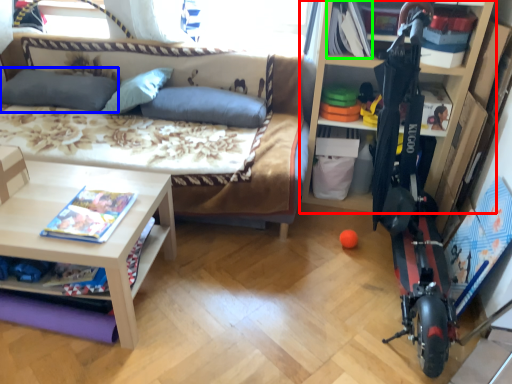
Question: Which object is positioned farthest from shelf (highlighted by a red box)? Select from pillow (highlighted by a blue box) and book (highlighted by a green box).

Choices:
 (A) pillow
 (B) book

Answer: (A)